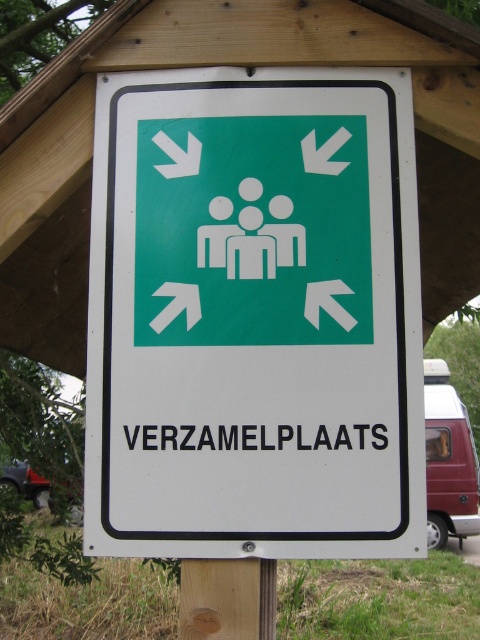
You are a maintenance worker who needs to attach a new sign to a post. The new sign must be placed exactly 20 inches away from the post. Looking at the existing green plastic sign at center and wooden post at center in the image, can you determine if the current spacing between them meets the requirement?

The distance between the green plastic sign at center and wooden post at center is 19.90 inches, which is just 0.10 inches less than the required 20 inches. Therefore, the current spacing does not meet the requirement.

You are a delivery person trying to attach a new sign to the wooden post at center. The existing green plastic sign at center is already mounted there. Based on the scene, where should you place your new sign?

The green plastic sign at center is already mounted above the wooden post at center. To place your new sign, you should position it below the existing green plastic sign at center so it doesn not overlap.